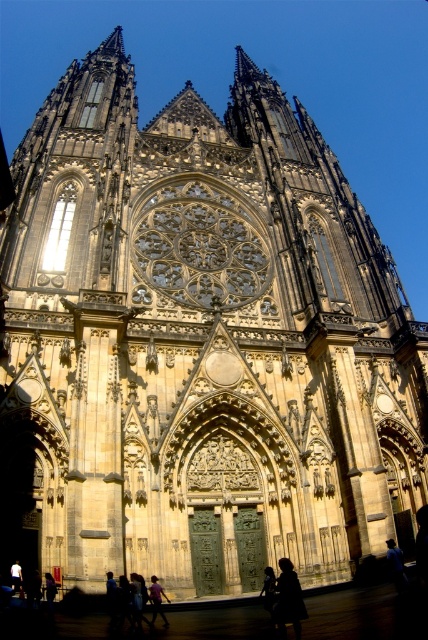
Who is shorter, dark hair at lower center or dark blue jeans at center?

dark blue jeans at center

Who is taller, dark hair at lower center or dark blue jeans at center?

Answer: Standing taller between the two is dark hair at lower center.

Describe the element at coordinates (288, 600) in the screenshot. I see `dark hair at lower center` at that location.

Where is `dark hair at lower center`? Image resolution: width=428 pixels, height=640 pixels. dark hair at lower center is located at coordinates (288, 600).

Between point (288, 564) and point (11, 584), which one is positioned behind?

Positioned behind is point (11, 584).

Which is above, dark hair at lower center or dark brown leather jacket at lower left?

dark hair at lower center is higher up.

Who is more distant from viewer, (279, 586) or (14, 568)?

Point (14, 568)

In order to click on dark hair at lower center in this screenshot , I will do coord(288,600).

Is point (155, 600) more distant than point (14, 588)?

No.

This screenshot has height=640, width=428. Find the location of `dark blue jeans at center`. dark blue jeans at center is located at coordinates (157, 600).

You are a GUI agent. You are given a task and a screenshot of the screen. Output one action in this format:
    pyautogui.click(x=<x>, y=<y>)
    Task: Click on the dark blue jeans at center
    
    Given the screenshot: What is the action you would take?
    pyautogui.click(x=157, y=600)